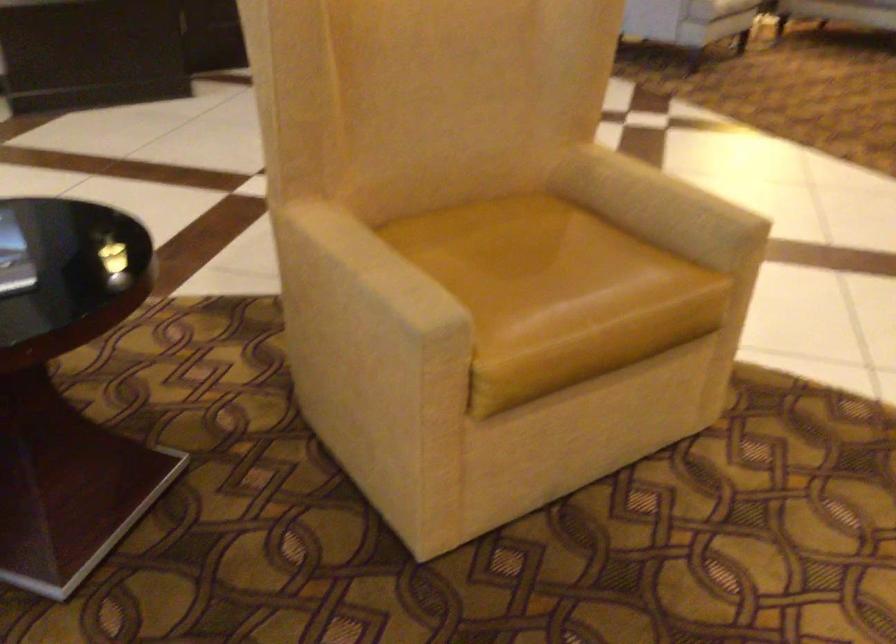
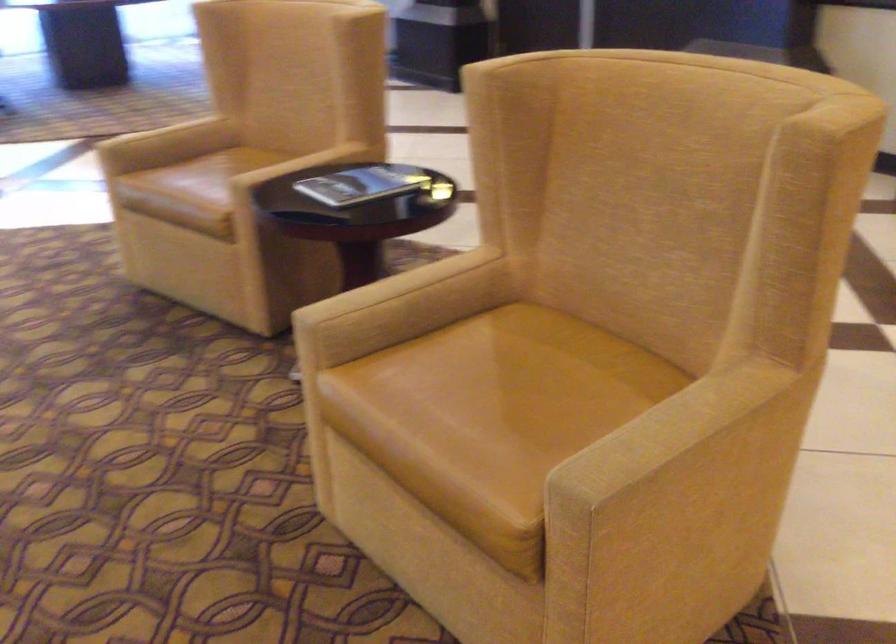
The point at (552, 270) is marked in the first image. Where is the corresponding point in the second image?

(500, 398)